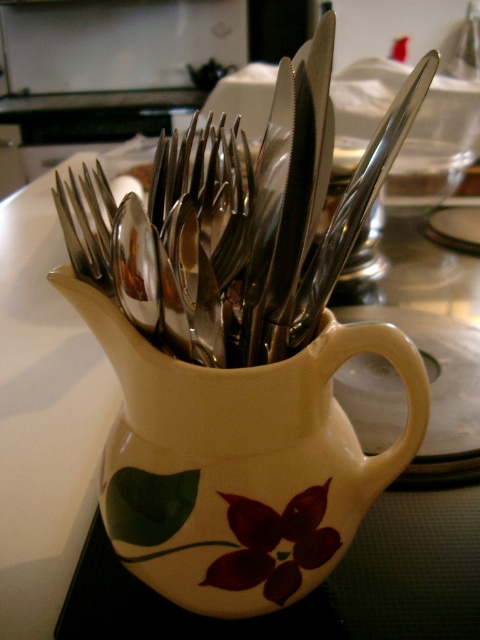
Question: Among these points, which one is farthest from the camera?

Choices:
 (A) (367, 172)
 (B) (112, 280)

Answer: (B)

Question: Which of the following is the farthest from the observer?

Choices:
 (A) white ceramic jug at center
 (B) satin silver fork at center
 (C) satin silver knife at upper center

Answer: (B)

Question: Is white ceramic jug at center to the left of satin silver knife at upper center from the viewer's perspective?

Choices:
 (A) no
 (B) yes

Answer: (B)

Question: Among these points, which one is farthest from the camera?

Choices:
 (A) (190, 406)
 (B) (67, 248)

Answer: (B)

Question: Is white ceramic jug at center wider than satin silver fork at center?

Choices:
 (A) yes
 (B) no

Answer: (A)

Question: Can you confirm if satin silver knife at upper center is smaller than satin silver fork at center?

Choices:
 (A) no
 (B) yes

Answer: (A)